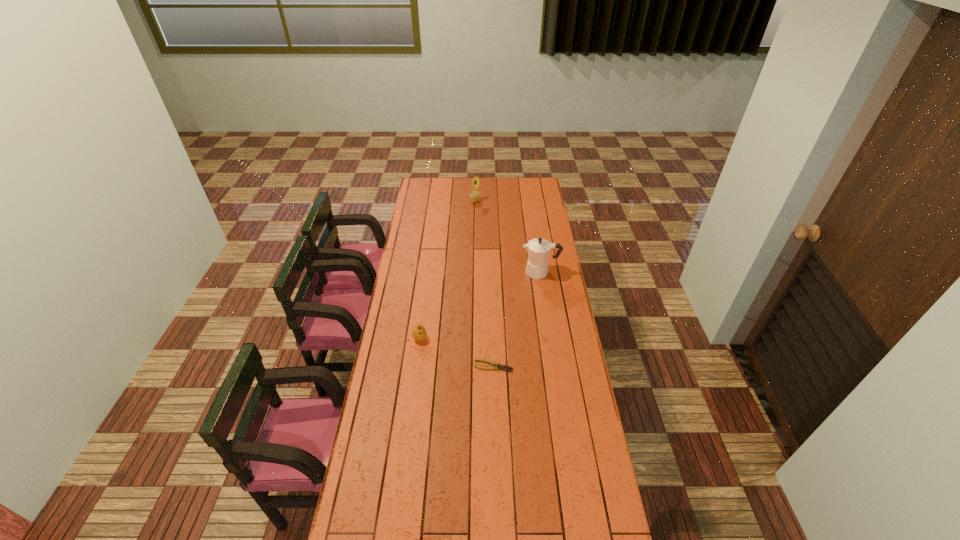
Locate an element on the screen. The image size is (960, 540). free space at the far right corner is located at coordinates (538, 187).

Locate an element on the screen. This screenshot has height=540, width=960. free space between the coffeepot and the farthest object is located at coordinates (507, 237).

Find the location of a particular element. The height and width of the screenshot is (540, 960). free space between the coffeepot and the pliers is located at coordinates (516, 319).

This screenshot has height=540, width=960. In order to click on free space between the shortest object and the sunflower in this screenshot , I will do `click(484, 284)`.

Where is `vacant area that lies between the shortest object and the third tallest object`? Image resolution: width=960 pixels, height=540 pixels. vacant area that lies between the shortest object and the third tallest object is located at coordinates (456, 353).

I want to click on free space between the coffeepot and the second nearest object, so click(479, 306).

Locate an element on the screen. The image size is (960, 540). vacant space that's between the rightmost object and the shortest object is located at coordinates click(x=516, y=319).

You are a GUI agent. You are given a task and a screenshot of the screen. Output one action in this format:
    pyautogui.click(x=<x>, y=<y>)
    Task: Click on the vacant space in between the sunflower and the third farthest object
    The image size is (960, 540).
    Given the screenshot: What is the action you would take?
    pyautogui.click(x=446, y=271)

Identify the location of the second closest object to the third shortest object. pyautogui.click(x=419, y=333).

The height and width of the screenshot is (540, 960). In order to click on object identified as the closest to the pear in this screenshot , I will do `click(496, 366)`.